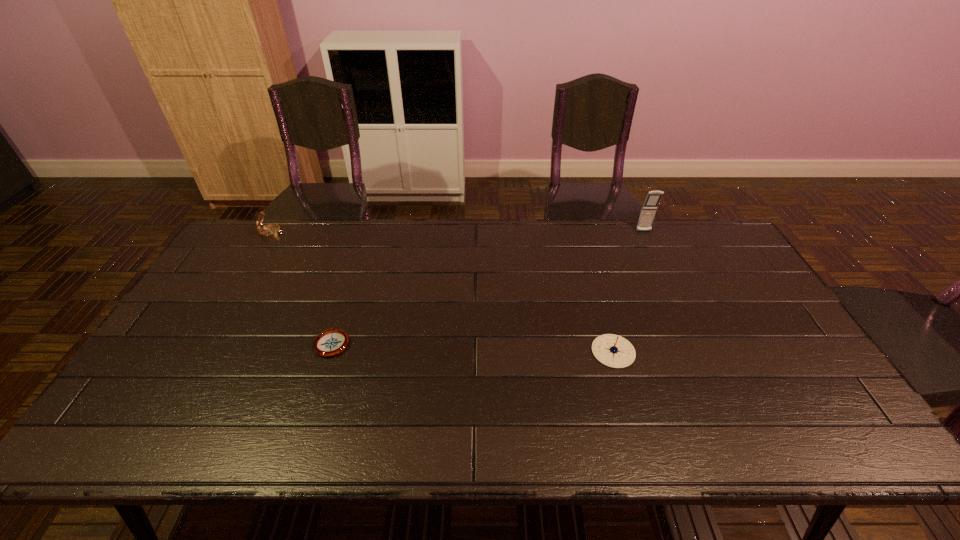
Image resolution: width=960 pixels, height=540 pixels. What are the coordinates of `free region located on the left of the second shortest object` in the screenshot? It's located at (449, 352).

You are a GUI agent. You are given a task and a screenshot of the screen. Output one action in this format:
    pyautogui.click(x=<x>, y=<y>)
    Task: Click on the free location located 0.270m on the back of the second compass from left to right
    This screenshot has height=540, width=960.
    Given the screenshot: What is the action you would take?
    pyautogui.click(x=357, y=265)

This screenshot has height=540, width=960. I want to click on cellular telephone that is at the far edge, so click(x=649, y=208).

The width and height of the screenshot is (960, 540). I want to click on compass that is at the far edge, so click(269, 231).

At what (x,y) coordinates should I click in order to perform the action: click on object present at the left edge. Please return your answer as a coordinate pair (x, y). Image resolution: width=960 pixels, height=540 pixels. Looking at the image, I should click on (269, 231).

At what (x,y) coordinates should I click in order to perform the action: click on object that is at the far left corner. Please return your answer as a coordinate pair (x, y). Image resolution: width=960 pixels, height=540 pixels. Looking at the image, I should click on pyautogui.click(x=269, y=231).

Image resolution: width=960 pixels, height=540 pixels. In the image, there is a desktop. Find the location of `blank space at the far edge`. blank space at the far edge is located at coordinates (481, 256).

You are a GUI agent. You are given a task and a screenshot of the screen. Output one action in this format:
    pyautogui.click(x=<x>, y=<y>)
    Task: Click on the free space at the near edge
    Image resolution: width=960 pixels, height=540 pixels.
    Given the screenshot: What is the action you would take?
    pyautogui.click(x=341, y=436)

This screenshot has height=540, width=960. In the image, there is a desktop. Find the location of `free space at the left edge`. free space at the left edge is located at coordinates (250, 288).

This screenshot has width=960, height=540. In the image, there is a desktop. Identify the location of free space at the right edge. (731, 288).